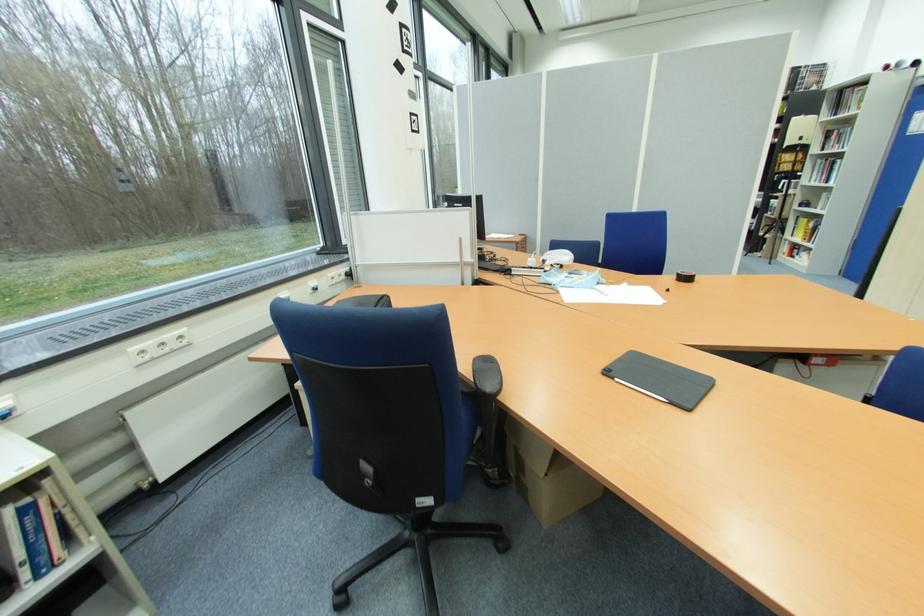
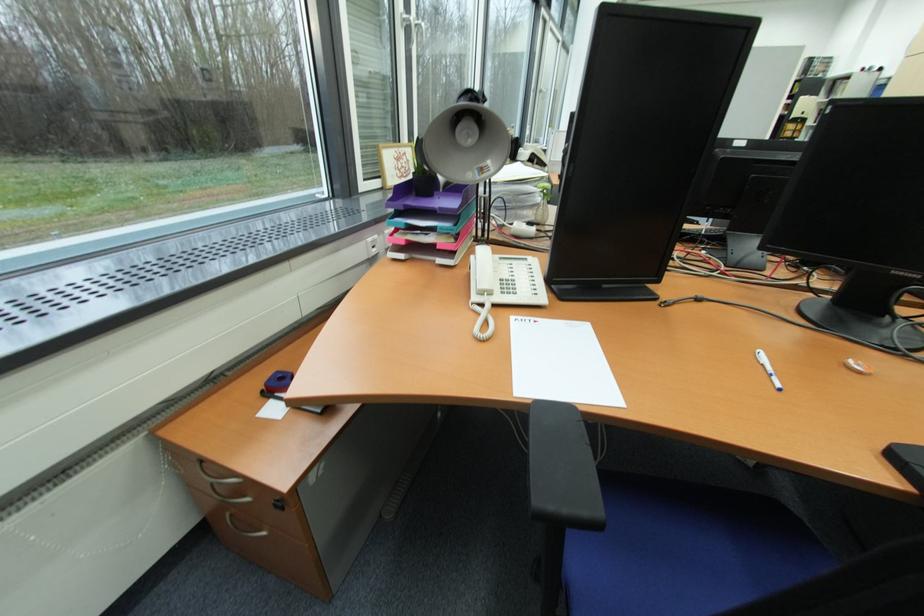
The images are taken continuously from a first-person perspective. In which direction are you moving?

The movement direction of the cameraman is left, backward.